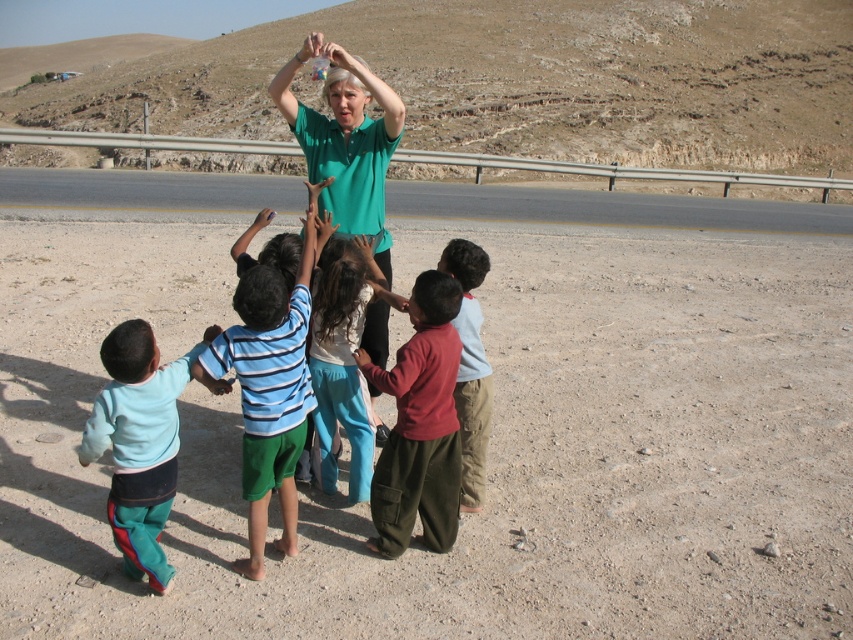
You are a pedestrian standing on the asphalt road at center and want to reach the smooth blue shirt at lower left. Which direction should you walk to get there?

The asphalt road at center is located above the smooth blue shirt at lower left, so you should walk downward to reach the smooth blue shirt at lower left.

You are a photographer trying to capture a candid shot of the adult holding the container. You notice the light blue cotton pants at lower left and the smooth skin hand at center. Which object should you focus on first to ensure both are in the frame?

The light blue cotton pants at lower left is in front of the smooth skin hand at center, so you should focus on the light blue cotton pants at lower left first to ensure both are in the frame.